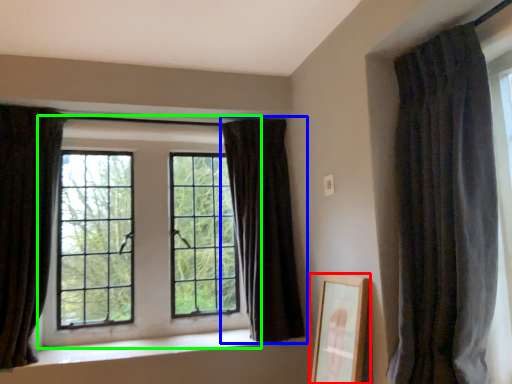
Question: Which is nearer to the picture frame (highlighted by a red box)? curtain (highlighted by a blue box) or window (highlighted by a green box).

Choices:
 (A) curtain
 (B) window

Answer: (A)